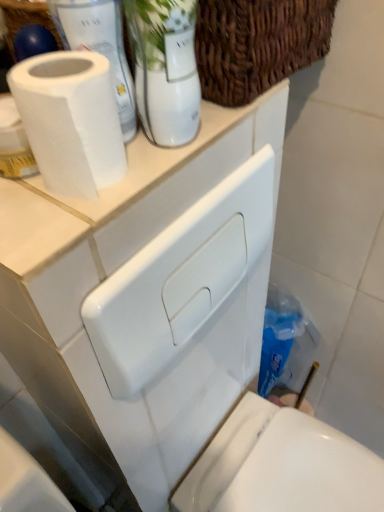
Question: Can you confirm if woven brown basket at upper center is bigger than blue plastic bottle at lower right?

Choices:
 (A) yes
 (B) no

Answer: (A)

Question: From the image's perspective, is woven brown basket at upper center above blue plastic bottle at lower right?

Choices:
 (A) no
 (B) yes

Answer: (B)

Question: Can blue plastic bottle at lower right be found inside woven brown basket at upper center?

Choices:
 (A) yes
 (B) no

Answer: (B)

Question: From the image's perspective, does woven brown basket at upper center appear lower than blue plastic bottle at lower right?

Choices:
 (A) no
 (B) yes

Answer: (A)

Question: Are woven brown basket at upper center and blue plastic bottle at lower right beside each other?

Choices:
 (A) yes
 (B) no

Answer: (B)

Question: Is woven brown basket at upper center wider than blue plastic bottle at lower right?

Choices:
 (A) yes
 (B) no

Answer: (A)

Question: Considering the relative sizes of white matte counter top at upper center and woven brown basket at upper center in the image provided, is white matte counter top at upper center thinner than woven brown basket at upper center?

Choices:
 (A) yes
 (B) no

Answer: (B)

Question: Does white matte counter top at upper center have a greater height compared to woven brown basket at upper center?

Choices:
 (A) yes
 (B) no

Answer: (B)

Question: Is white matte counter top at upper center far away from woven brown basket at upper center?

Choices:
 (A) no
 (B) yes

Answer: (A)

Question: From a real-world perspective, is white matte counter top at upper center physically above woven brown basket at upper center?

Choices:
 (A) yes
 (B) no

Answer: (B)

Question: Does white matte counter top at upper center have a lesser height compared to woven brown basket at upper center?

Choices:
 (A) no
 (B) yes

Answer: (B)

Question: Is the depth of white matte counter top at upper center less than that of woven brown basket at upper center?

Choices:
 (A) yes
 (B) no

Answer: (A)

Question: From a real-world perspective, is woven brown basket at upper center physically below white glossy toilet at lower right?

Choices:
 (A) no
 (B) yes

Answer: (A)